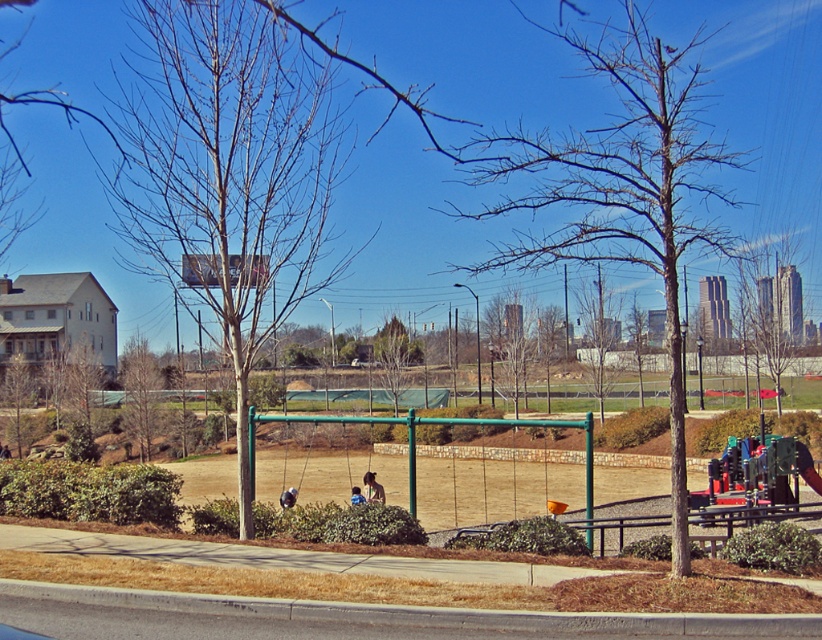
Image resolution: width=822 pixels, height=640 pixels. What do you see at coordinates (356, 496) in the screenshot?
I see `blue denim shirt at center` at bounding box center [356, 496].

Does point (358, 500) come closer to viewer compared to point (7, 454)?

That is True.

Between point (359, 496) and point (1, 458), which one is positioned behind?

The point (1, 458) is behind.

Identify the location of blue denim shirt at center. The height and width of the screenshot is (640, 822). (356, 496).

Between wooden swing at center and light brown hair at center, which one is positioned higher?

Positioned higher is light brown hair at center.

Between point (344, 448) and point (366, 497), which one is positioned behind?

The point (344, 448) is more distant.

You are a GUI agent. You are given a task and a screenshot of the screen. Output one action in this format:
    pyautogui.click(x=<x>, y=<y>)
    Task: Click on the wooden swing at center
    The width and height of the screenshot is (822, 640).
    Given the screenshot: What is the action you would take?
    pyautogui.click(x=359, y=448)

Can you confirm if bare wood tree at center is taller than wooden swing at center?

Correct, bare wood tree at center is much taller as wooden swing at center.

The image size is (822, 640). Describe the element at coordinates (619, 188) in the screenshot. I see `bare wood tree at center` at that location.

Who is more distant from viewer, [613,33] or [373,474]?

Positioned behind is point [613,33].

Identify the location of bare wood tree at center. (619, 188).